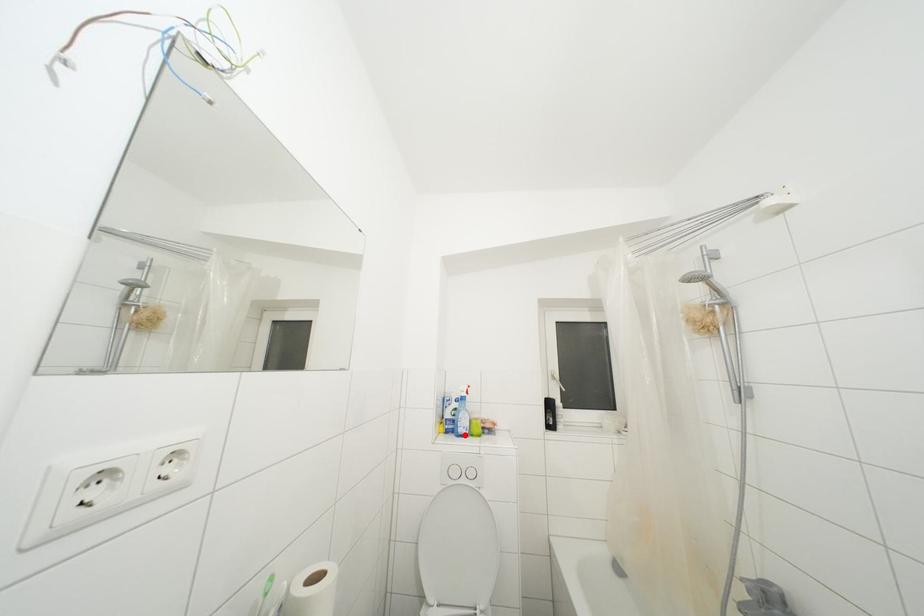
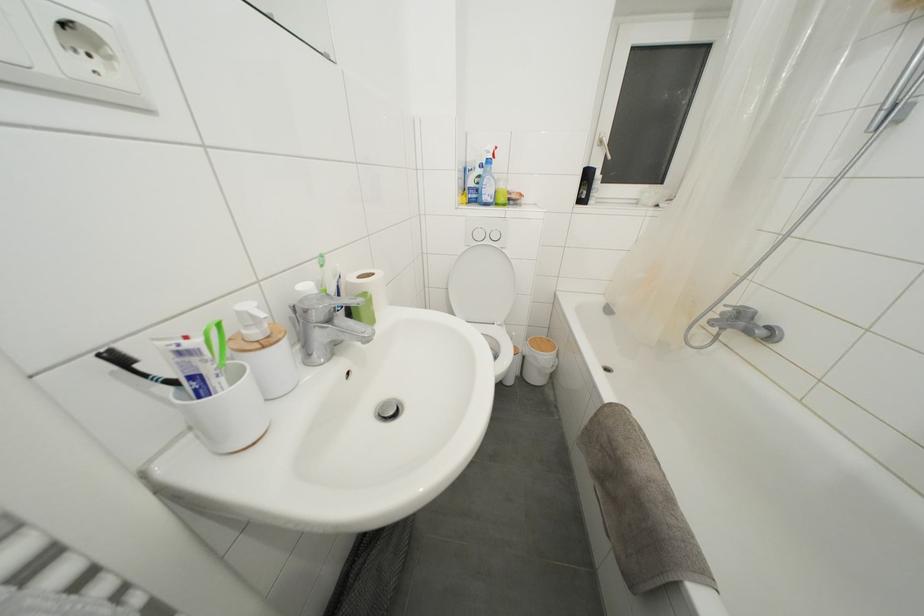
Question: I am providing you with two images of the same scene from different viewpoints. In image1, a red point is highlighted. Considering the same 3D point in image2, which of the following is correct?

Choices:
 (A) It is closer
 (B) It is farther

Answer: (A)